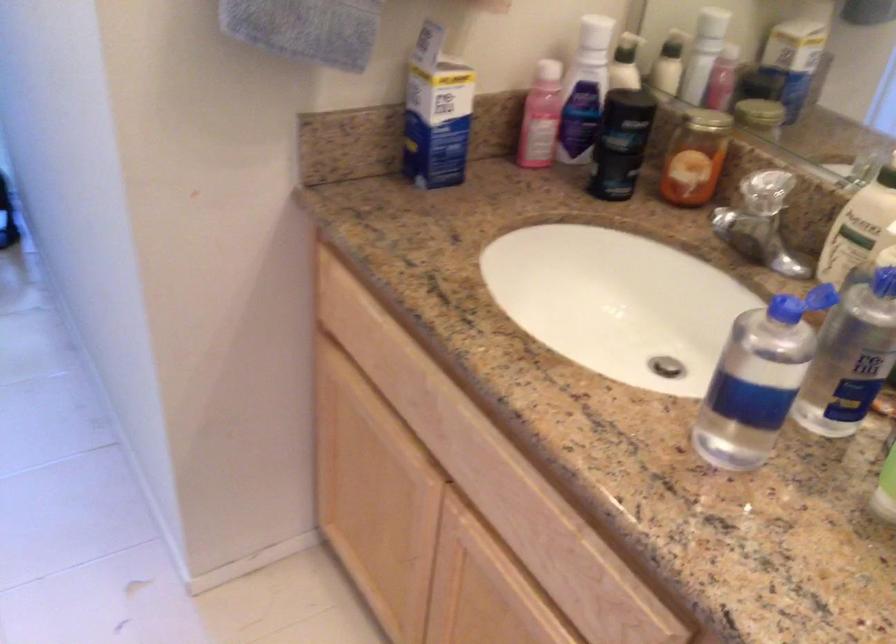
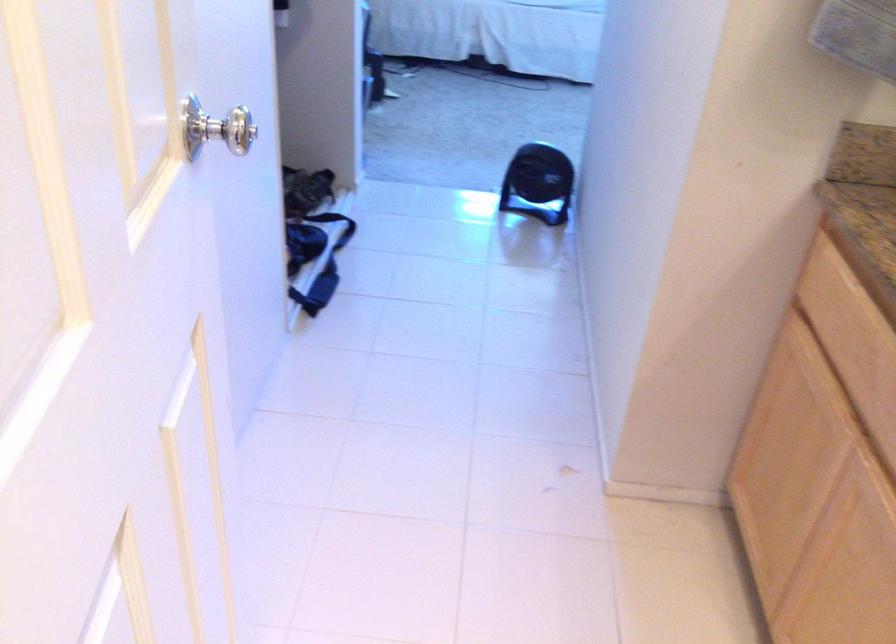
Question: The camera is either moving clockwise (left) or counter-clockwise (right) around the object. The first image is from the beginning of the video and the second image is from the end. Is the camera moving left or right when shooting the video?

Choices:
 (A) Left
 (B) Right

Answer: (B)